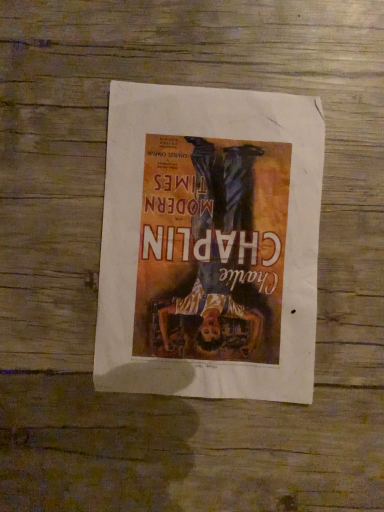
Locate an element on the screen. This screenshot has height=512, width=384. free space above matte paper poster at center (from a real-world perspective) is located at coordinates (211, 233).